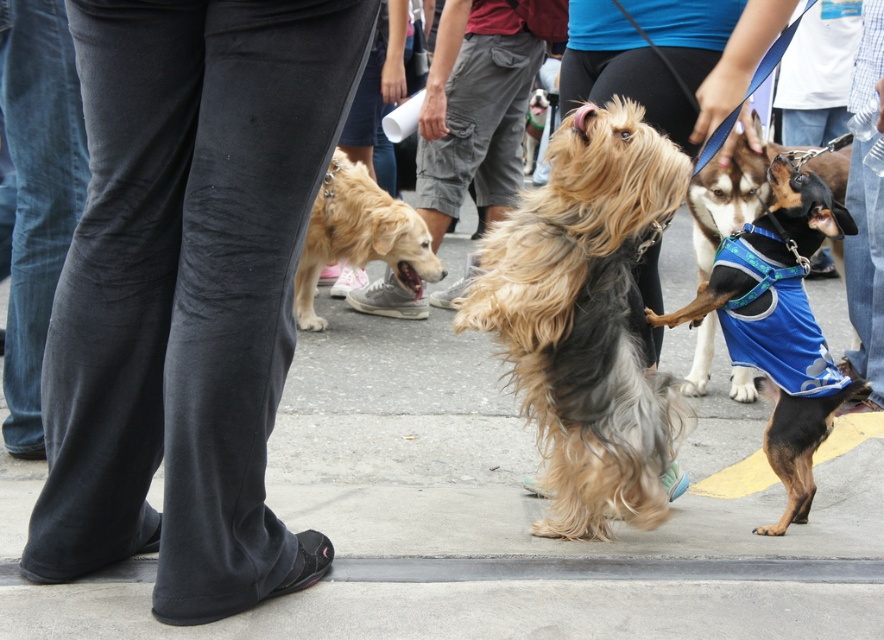
You are standing in the dog event scene and want to know which of the two points, point (425, 556) or point (592, 502), is closer to you. Can you determine this based on the scene?

Point (425, 556) is closer to the viewer than point (592, 502).

You are standing at the point marked as point (644,240) in the image. You want to throw a ball to a friend who is 10 feet away from you. Can you reach your friend by throwing the ball directly forward?

The distance between you and your friend is 10 feet, but the point (644,240) is only 9.26 feet away from the viewer. Therefore, you can reach your friend by throwing the ball directly forward as the distance is slightly less than 10 feet.